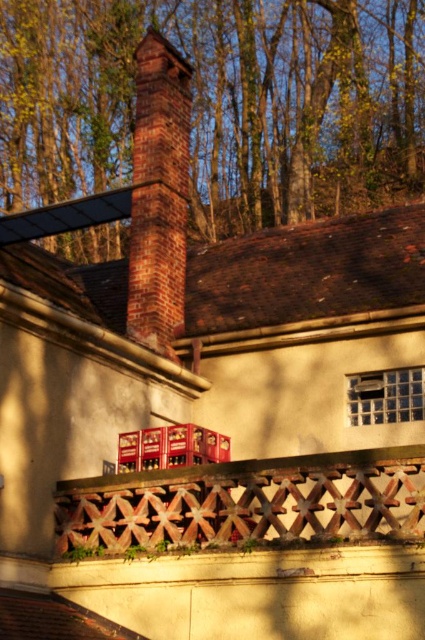
You are standing in front of the building and notice a brown wood tree at upper center and a wooden lattice at center. Which object is positioned more to the left side of the building?

The brown wood tree at upper center is positioned more to the left side of the building than the wooden lattice at center.

You are standing at a distance of 10 meters from the wooden lattice at center. Can you determine if you can see the red brick chimney at center from your current position?

The wooden lattice at center is 14.41 meters away from the red brick chimney at center. Since you are only 10 meters away from the wooden lattice at center, you are still 4.41 meters away from the red brick chimney at center, so you can see the red brick chimney at center from your current position.